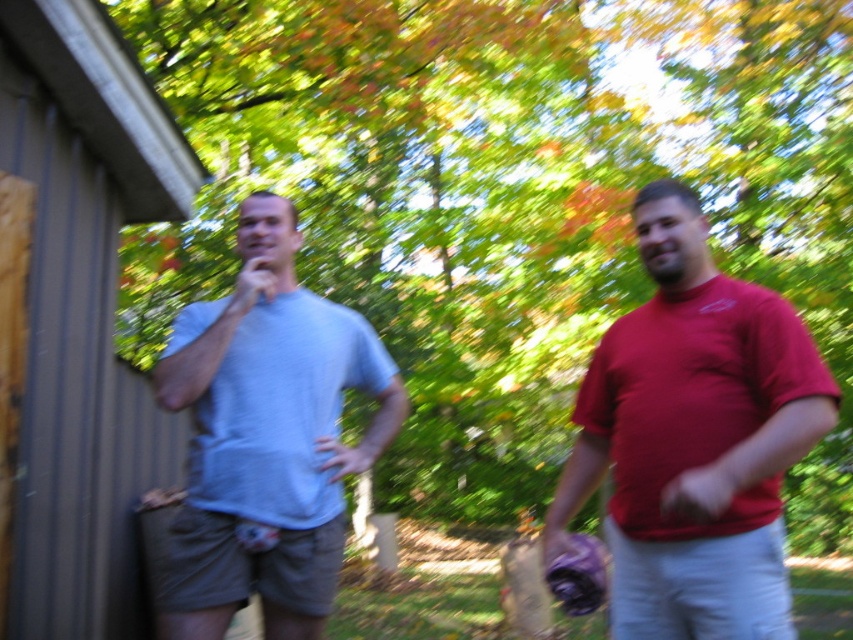
Question: Can you confirm if light blue cotton t-shirt at left is wider than purple fabric baseball glove at lower right?

Choices:
 (A) yes
 (B) no

Answer: (A)

Question: Is light blue cotton t-shirt at left above purple fabric baseball glove at lower right?

Choices:
 (A) no
 (B) yes

Answer: (B)

Question: Which object appears farthest from the camera in this image?

Choices:
 (A) matte red t-shirt at right
 (B) light blue t-shirt at center
 (C) light blue cotton t-shirt at left

Answer: (B)

Question: Considering the real-world distances, which object is closest to the purple fabric baseball glove at lower right?

Choices:
 (A) light blue t-shirt at center
 (B) matte red t-shirt at right
 (C) wooden plank at left
 (D) light blue cotton t-shirt at left

Answer: (B)

Question: Can you confirm if light blue t-shirt at center is thinner than purple fabric baseball glove at lower right?

Choices:
 (A) yes
 (B) no

Answer: (B)

Question: Which point is farther to the camera?

Choices:
 (A) light blue t-shirt at center
 (B) wooden plank at left
 (C) matte red t-shirt at right
 (D) purple fabric baseball glove at lower right

Answer: (B)